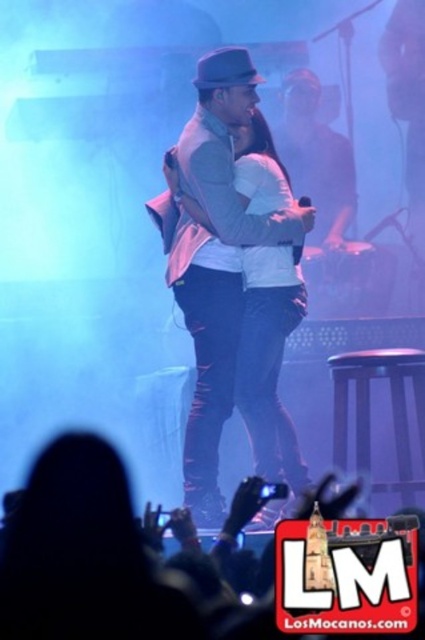
Does brown wooden stool at lower right appear on the left side of matte black fedora at upper center?

In fact, brown wooden stool at lower right is to the right of matte black fedora at upper center.

Is brown wooden stool at lower right smaller than matte black fedora at upper center?

No, brown wooden stool at lower right is not smaller than matte black fedora at upper center.

What do you see at coordinates (368, 406) in the screenshot? I see `brown wooden stool at lower right` at bounding box center [368, 406].

Where is `brown wooden stool at lower right`? The width and height of the screenshot is (425, 640). brown wooden stool at lower right is located at coordinates (368, 406).

What are the coordinates of `white matte vest at center` in the screenshot? It's located at click(x=215, y=276).

You are a GUI agent. You are given a task and a screenshot of the screen. Output one action in this format:
    pyautogui.click(x=<x>, y=<y>)
    Task: Click on the white matte vest at center
    This screenshot has height=640, width=425.
    Given the screenshot: What is the action you would take?
    pyautogui.click(x=215, y=276)

Where is `white matte vest at center`? white matte vest at center is located at coordinates (215, 276).

Based on the photo, does white matte vest at center have a lesser height compared to matte black fedora at upper center?

No.

Is white matte vest at center positioned before matte black fedora at upper center?

Yes, it is.

Between point (223, 257) and point (201, 60), which one is positioned behind?

Point (223, 257)

The height and width of the screenshot is (640, 425). In order to click on white matte vest at center in this screenshot , I will do `click(215, 276)`.